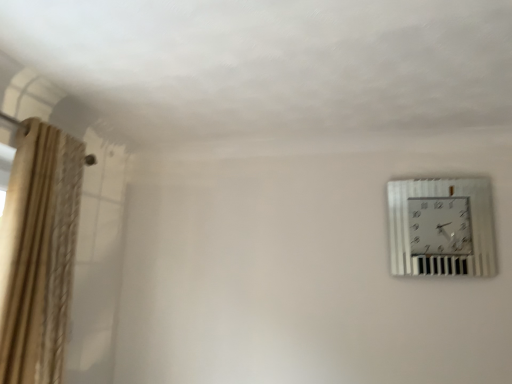
Question: From a real-world perspective, is beige textured curtain at left located beneath metallic silver wall clock at upper right?

Choices:
 (A) yes
 (B) no

Answer: (A)

Question: Does beige textured curtain at left have a greater height compared to metallic silver wall clock at upper right?

Choices:
 (A) no
 (B) yes

Answer: (B)

Question: Is beige textured curtain at left at the left side of metallic silver wall clock at upper right?

Choices:
 (A) yes
 (B) no

Answer: (A)

Question: Can metallic silver wall clock at upper right be found inside beige textured curtain at left?

Choices:
 (A) yes
 (B) no

Answer: (B)

Question: Does beige textured curtain at left appear on the right side of metallic silver wall clock at upper right?

Choices:
 (A) yes
 (B) no

Answer: (B)

Question: Is beige textured curtain at left smaller than metallic silver wall clock at upper right?

Choices:
 (A) no
 (B) yes

Answer: (A)

Question: Is metallic silver wall clock at upper right touching beige textured curtain at left?

Choices:
 (A) no
 (B) yes

Answer: (A)

Question: Is the position of metallic silver wall clock at upper right less distant than that of beige textured curtain at left?

Choices:
 (A) no
 (B) yes

Answer: (A)

Question: From the image's perspective, does metallic silver wall clock at upper right appear higher than beige textured curtain at left?

Choices:
 (A) yes
 (B) no

Answer: (A)

Question: Would you say beige textured curtain at left is part of metallic silver wall clock at upper right's contents?

Choices:
 (A) yes
 (B) no

Answer: (B)

Question: From a real-world perspective, is metallic silver wall clock at upper right located higher than beige textured curtain at left?

Choices:
 (A) yes
 (B) no

Answer: (A)

Question: Considering the relative sizes of metallic silver wall clock at upper right and beige textured curtain at left in the image provided, is metallic silver wall clock at upper right shorter than beige textured curtain at left?

Choices:
 (A) no
 (B) yes

Answer: (B)

Question: Considering the positions of metallic silver wall clock at upper right and beige textured curtain at left in the image, is metallic silver wall clock at upper right bigger or smaller than beige textured curtain at left?

Choices:
 (A) big
 (B) small

Answer: (B)